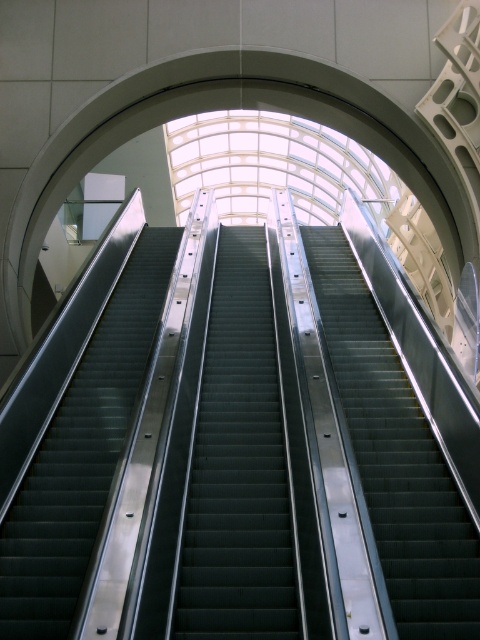
Can you confirm if metallic gray stairs at center is positioned below metallic silver escalator at left?

Indeed, metallic gray stairs at center is positioned under metallic silver escalator at left.

Is point (181, 620) more distant than point (73, 564)?

No, (181, 620) is in front of (73, 564).

In order to click on metallic gray stairs at center in this screenshot , I will do `click(238, 465)`.

Can you confirm if metallic gray stairs at center is bigger than metallic escalator steps at center?

No, metallic gray stairs at center is not bigger than metallic escalator steps at center.

What do you see at coordinates (238, 465) in the screenshot? The width and height of the screenshot is (480, 640). I see `metallic gray stairs at center` at bounding box center [238, 465].

You are a GUI agent. You are given a task and a screenshot of the screen. Output one action in this format:
    pyautogui.click(x=<x>, y=<y>)
    Task: Click on the metallic gray stairs at center
    
    Given the screenshot: What is the action you would take?
    pyautogui.click(x=238, y=465)

Is metallic escalator steps at center thinner than metallic silver escalator at left?

Correct, metallic escalator steps at center's width is less than metallic silver escalator at left's.

Who is more forward, (387,390) or (119,420)?

Positioned in front is point (119,420).

The image size is (480, 640). What do you see at coordinates (396, 456) in the screenshot? I see `metallic escalator steps at center` at bounding box center [396, 456].

Image resolution: width=480 pixels, height=640 pixels. What are the coordinates of `metallic escalator steps at center` in the screenshot? It's located at (396, 456).